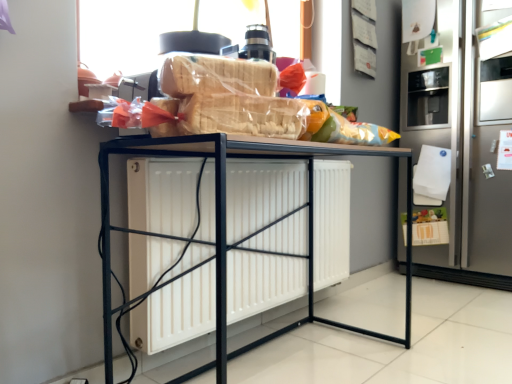
The image size is (512, 384). What do you see at coordinates (225, 226) in the screenshot? I see `black metal table at center` at bounding box center [225, 226].

What is the approximate height of black metal table at center?

29.90 inches.

Where is `black metal table at center`? The height and width of the screenshot is (384, 512). black metal table at center is located at coordinates (225, 226).

What do you see at coordinates (464, 142) in the screenshot? I see `satin silver refrigerator at right` at bounding box center [464, 142].

At what (x,y) coordinates should I click in order to perform the action: click on satin silver refrigerator at right. Please return your answer as a coordinate pair (x, y). Looking at the image, I should click on (464, 142).

Locate an element on the screen. The width and height of the screenshot is (512, 384). black metal table at center is located at coordinates (225, 226).

Is black metal table at center at the left side of satin silver refrigerator at right?

Yes.

Considering the relative positions of black metal table at center and satin silver refrigerator at right in the image provided, is black metal table at center in front of satin silver refrigerator at right?

That is True.

Between point (273, 143) and point (416, 231), which one is positioned behind?

The point (416, 231) is more distant.

From the image's perspective, which object appears higher, black metal table at center or satin silver refrigerator at right?

satin silver refrigerator at right, from the image's perspective.

From a real-world perspective, who is located higher, black metal table at center or satin silver refrigerator at right?

satin silver refrigerator at right is physically above.

Considering the sizes of objects black metal table at center and satin silver refrigerator at right in the image provided, who is thinner, black metal table at center or satin silver refrigerator at right?

Thinner between the two is black metal table at center.

Considering the relative sizes of black metal table at center and satin silver refrigerator at right in the image provided, is black metal table at center shorter than satin silver refrigerator at right?

Indeed, black metal table at center has a lesser height compared to satin silver refrigerator at right.

Is black metal table at center smaller than satin silver refrigerator at right?

Indeed, black metal table at center has a smaller size compared to satin silver refrigerator at right.

Is black metal table at center not inside satin silver refrigerator at right?

Yes.

Is black metal table at center directly adjacent to satin silver refrigerator at right?

No, black metal table at center is not in contact with satin silver refrigerator at right.

Is black metal table at center positioned with its back to satin silver refrigerator at right?

No, black metal table at center is not facing away from satin silver refrigerator at right.

Can you tell me how much black metal table at center and satin silver refrigerator at right differ in facing direction?

They differ by 91.6 degrees in their facing directions.

In order to click on furniture in front of the satin silver refrigerator at right in this screenshot , I will do `click(225, 226)`.

Considering the positions of objects satin silver refrigerator at right and black metal table at center in the image provided, who is more to the right, satin silver refrigerator at right or black metal table at center?

Positioned to the right is satin silver refrigerator at right.

In the image, is satin silver refrigerator at right positioned in front of or behind black metal table at center?

In the image, satin silver refrigerator at right appears behind black metal table at center.

In the scene shown: Which is less distant, (x=453, y=2) or (x=103, y=186)?

The point (x=103, y=186) is more forward.

From the image's perspective, which is above, satin silver refrigerator at right or black metal table at center?

satin silver refrigerator at right.

From a real-world perspective, which object rests below the other?

From a 3D spatial view, black metal table at center is below.

Is satin silver refrigerator at right wider or thinner than black metal table at center?

In the image, satin silver refrigerator at right appears to be wider than black metal table at center.

Considering the sizes of objects satin silver refrigerator at right and black metal table at center in the image provided, who is taller, satin silver refrigerator at right or black metal table at center?

With more height is satin silver refrigerator at right.

Is satin silver refrigerator at right smaller than black metal table at center?

Incorrect, satin silver refrigerator at right is not smaller in size than black metal table at center.

Does satin silver refrigerator at right contain black metal table at center?

Actually, black metal table at center is outside satin silver refrigerator at right.

Is satin silver refrigerator at right far away from black metal table at center?

That's right, there is a large distance between satin silver refrigerator at right and black metal table at center.

Is satin silver refrigerator at right positioned with its back to black metal table at center?

satin silver refrigerator at right is not turned away from black metal table at center.

How much distance is there between satin silver refrigerator at right and black metal table at center?

satin silver refrigerator at right is 1.26 meters from black metal table at center.

Find the location of a particular element. furniture on the left side of satin silver refrigerator at right is located at coordinates (225, 226).

Locate an element on the screen. Image resolution: width=512 pixels, height=384 pixels. fridge that appears on the right of black metal table at center is located at coordinates (464, 142).

In order to click on furniture that appears in front of the satin silver refrigerator at right in this screenshot , I will do `click(225, 226)`.